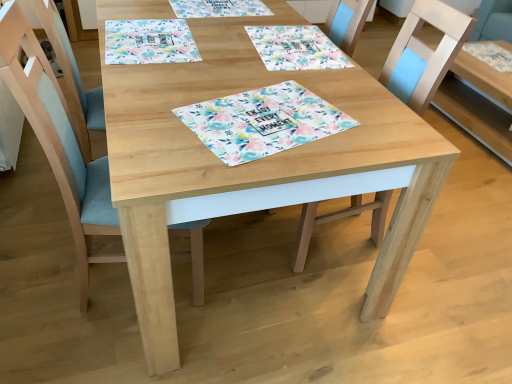
Find the location of a particular element. Image resolution: width=512 pixels, height=384 pixels. vacant space situated on the left part of floral paper placemat at center is located at coordinates (158, 102).